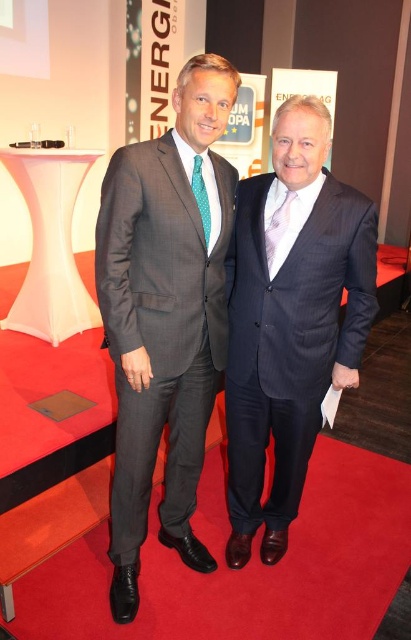
Between matte gray suit at center and matte blue suit at center, which one appears on the left side from the viewer's perspective?

From the viewer's perspective, matte gray suit at center appears more on the left side.

Is matte gray suit at center wider than matte blue suit at center?

In fact, matte gray suit at center might be narrower than matte blue suit at center.

Is point (203, 348) more distant than point (244, 221)?

Yes, it is behind point (244, 221).

Where is `matte gray suit at center`? matte gray suit at center is located at coordinates (164, 314).